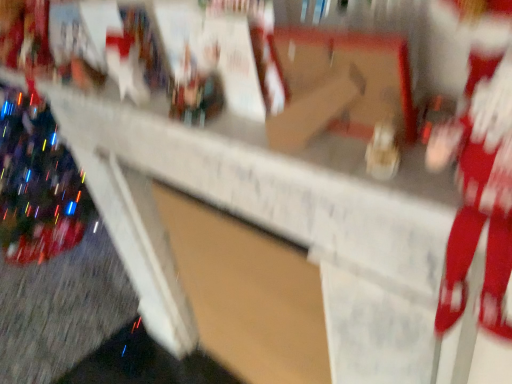
Question: Should I look upward or downward to see red plush santa at right?

Choices:
 (A) up
 (B) down

Answer: (A)